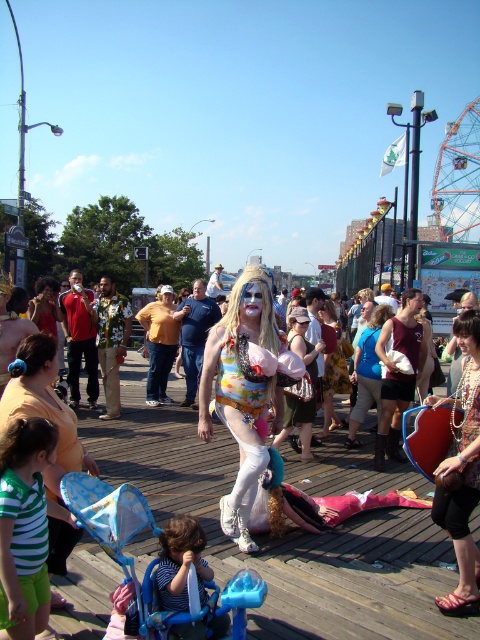
Is multicolored sequined bodysuit at center below floral print shirt at center?

Indeed, multicolored sequined bodysuit at center is positioned under floral print shirt at center.

Is multicolored sequined bodysuit at center positioned at the back of floral print shirt at center?

No.

Which is in front, point (236, 490) or point (95, 300)?

Point (236, 490) is more forward.

The height and width of the screenshot is (640, 480). In order to click on multicolored sequined bodysuit at center in this screenshot , I will do (x=252, y=417).

Can you confirm if red fabric shirt at left is positioned to the right of matte yellow shirt at center?

Incorrect, red fabric shirt at left is not on the right side of matte yellow shirt at center.

Who is positioned more to the right, red fabric shirt at left or matte yellow shirt at center?

matte yellow shirt at center is more to the right.

Is point (80, 356) closer to viewer compared to point (312, 310)?

No, it is behind (312, 310).

This screenshot has height=640, width=480. Find the location of `red fabric shirt at left`. red fabric shirt at left is located at coordinates (80, 337).

Is the position of blue plastic baby carriage at lower left more distant than that of matte yellow shirt at center?

No, it is in front of matte yellow shirt at center.

Is blue plastic baby carriage at lower left to the left of matte yellow shirt at center from the viewer's perspective?

Indeed, blue plastic baby carriage at lower left is positioned on the left side of matte yellow shirt at center.

What do you see at coordinates (153, 560) in the screenshot? I see `blue plastic baby carriage at lower left` at bounding box center [153, 560].

Find the location of a particular element. This screenshot has width=480, height=640. blue plastic baby carriage at lower left is located at coordinates (153, 560).